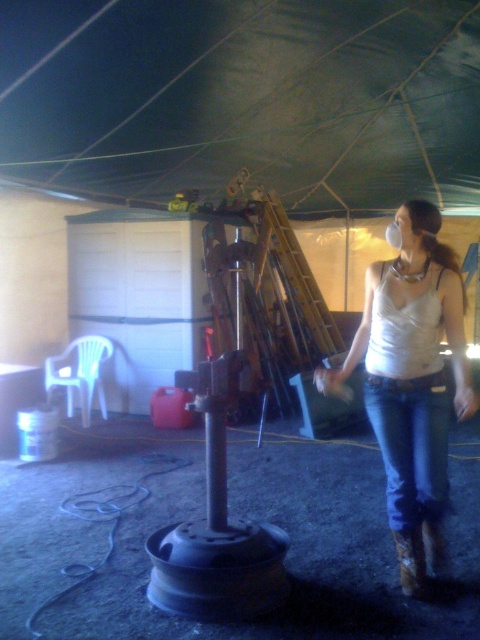
You are standing at the entrance of the workshop and notice two points marked on the floor. The first point is labeled as point (408,292) and the second as point (411,548). Which point is closer to you as you face the interior of the workshop?

Point (408,292) is in front of point (411,548), so it is closer to you as you face the interior of the workshop.

You are organizing a clothing donation drive and need to determine which item takes up more space horizontally. Based on the scene, which object is wider between the white matte tank top at center and the brown suede cowboy boot at lower right?

The white matte tank top at center is wider than the brown suede cowboy boot at lower right, so it takes up more horizontal space.